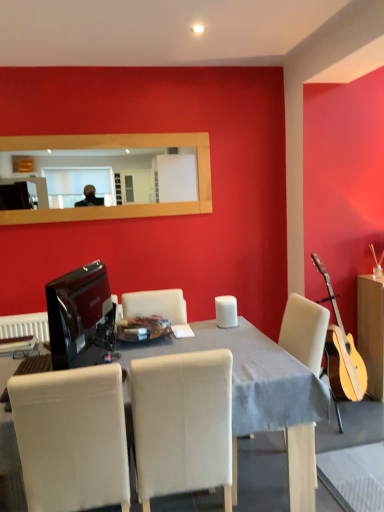
I want to click on free location above wooden frame mirror at upper center (from a real-world perspective), so click(91, 135).